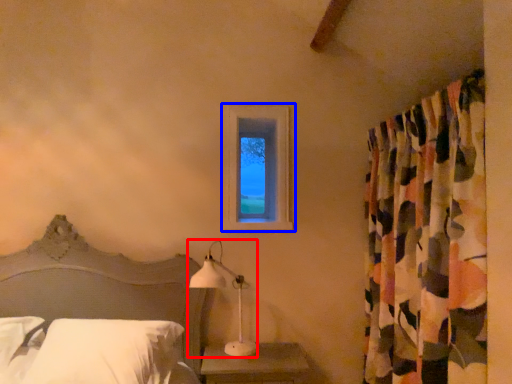
Question: Which point is closer to the camera, table lamp (highlighted by a red box) or window (highlighted by a blue box)?

Choices:
 (A) table lamp
 (B) window

Answer: (A)